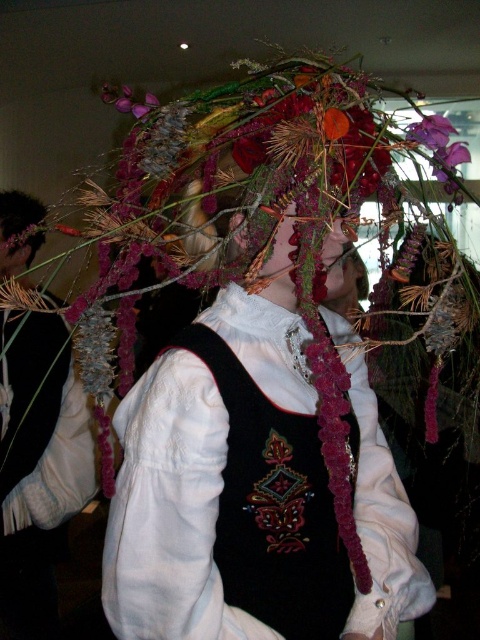
Question: Estimate the real-world distances between objects in this image. Which object is closer to the purple matte flower at upper center?

Choices:
 (A) matte black hair at upper left
 (B) fuzzy black vest at center
 (C) purple fabric flower at upper center

Answer: (A)

Question: From the image, what is the correct spatial relationship of fuzzy black vest at center in relation to matte black hair at upper left?

Choices:
 (A) below
 (B) above

Answer: (A)

Question: Which of the following is the farthest from the observer?

Choices:
 (A) (417, 131)
 (B) (132, 108)

Answer: (B)

Question: Among these points, which one is nearest to the camera?

Choices:
 (A) (428, 132)
 (B) (230, 324)

Answer: (B)

Question: Is burgundy fabric headdress at center below fuzzy floral crown at center?

Choices:
 (A) no
 (B) yes

Answer: (B)

Question: Considering the relative positions of embroidered velvet vest at center and purple matte flower at upper center in the image provided, where is embroidered velvet vest at center located with respect to purple matte flower at upper center?

Choices:
 (A) above
 (B) below

Answer: (B)